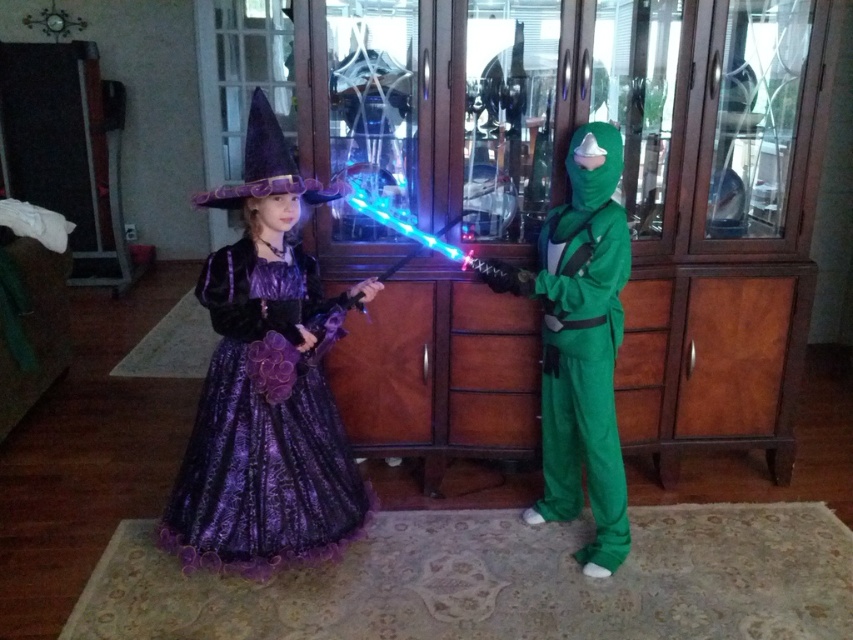
Can you confirm if green matte jumpsuit at right is positioned to the left of purple satin witch hat at upper center?

No, green matte jumpsuit at right is not to the left of purple satin witch hat at upper center.

Is point (612, 266) farther from viewer compared to point (265, 100)?

Yes, it is behind point (265, 100).

Locate an element on the screen. Image resolution: width=853 pixels, height=640 pixels. green matte jumpsuit at right is located at coordinates (583, 346).

From the picture: Does shiny purple dress at center have a greater width compared to green matte jumpsuit at right?

Indeed, shiny purple dress at center has a greater width compared to green matte jumpsuit at right.

Measure the distance between shiny purple dress at center and camera.

shiny purple dress at center and camera are 2.05 meters apart.

Where is `shiny purple dress at center`? shiny purple dress at center is located at coordinates (263, 424).

Does shiny purple dress at center appear on the left side of purple satin witch hat at upper center?

Yes, shiny purple dress at center is to the left of purple satin witch hat at upper center.

Which is above, shiny purple dress at center or purple satin witch hat at upper center?

Positioned higher is purple satin witch hat at upper center.

Between point (215, 262) and point (245, 141), which one is positioned in front?

Positioned in front is point (215, 262).

Find the location of a particular element. Image resolution: width=853 pixels, height=640 pixels. shiny purple dress at center is located at coordinates pos(263,424).